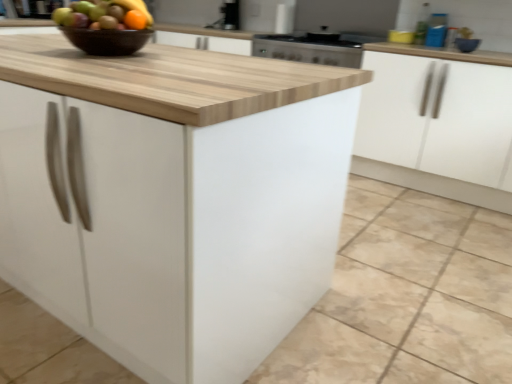
Image resolution: width=512 pixels, height=384 pixels. I want to click on vacant space in white matte cabinet at center, the second cabinetry positioned from the back (from a real-world perspective), so click(x=375, y=270).